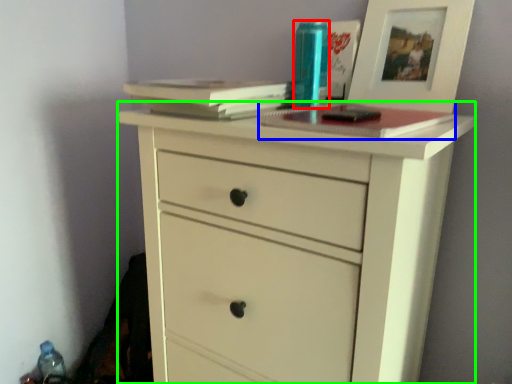
Question: Considering the real-world distances, which object is closest to bottle (highlighted by a red box)? paperback book (highlighted by a blue box) or chest of drawers (highlighted by a green box).

Choices:
 (A) paperback book
 (B) chest of drawers

Answer: (A)